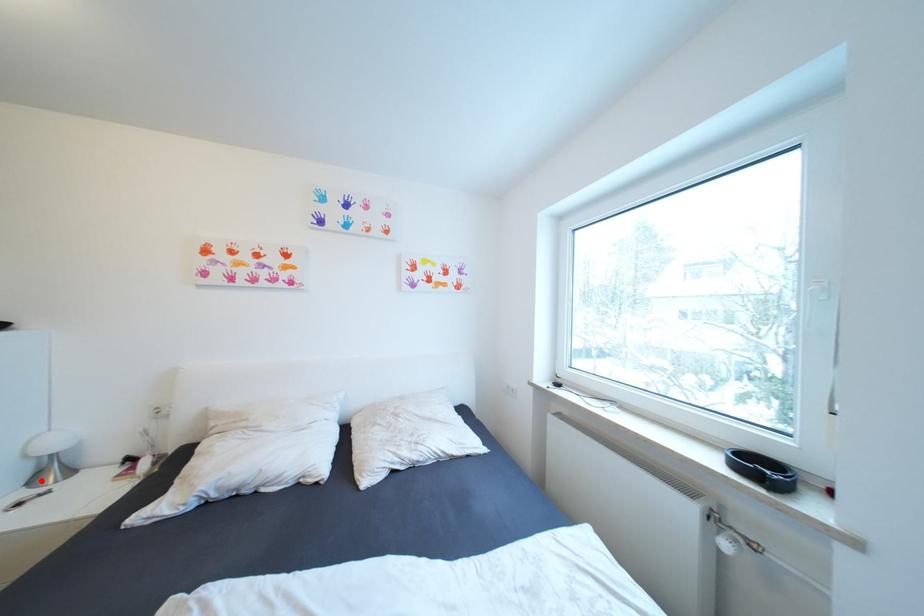
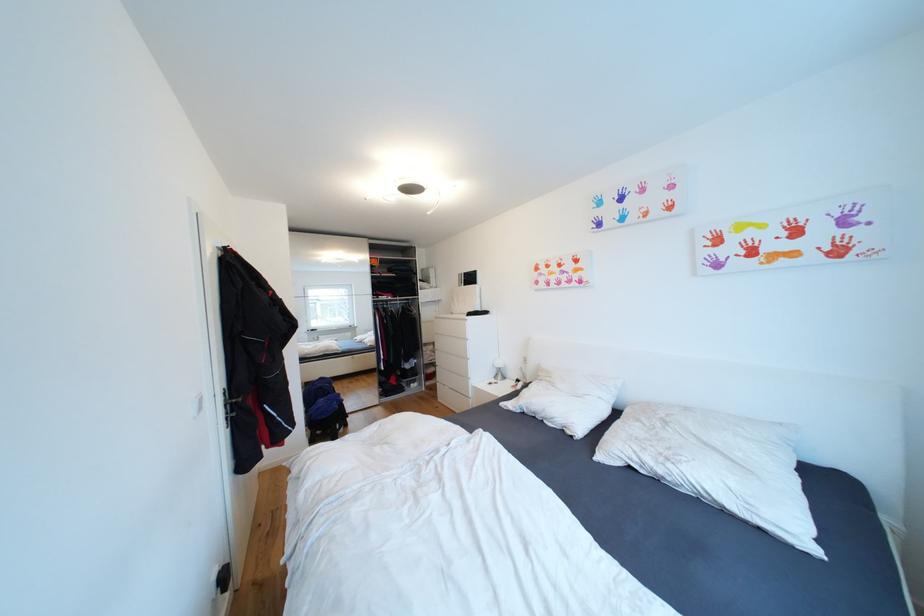
In the second image, find the point that corresponds to the highlighted location in the first image.

(503, 378)